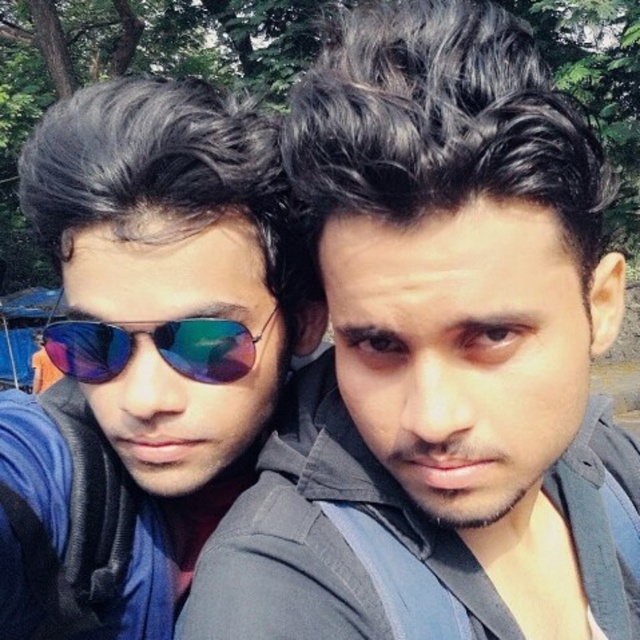
Image resolution: width=640 pixels, height=640 pixels. What do you see at coordinates (440, 355) in the screenshot? I see `dark gray hair at center` at bounding box center [440, 355].

Does dark gray hair at center have a lesser height compared to shiny reflective sunglasses at center?

No.

I want to click on dark gray hair at center, so click(440, 355).

Which of these two, dark gray hair at center or matte black sunglasses at left, stands shorter?

matte black sunglasses at left

Can you confirm if dark gray hair at center is bigger than matte black sunglasses at left?

Indeed, dark gray hair at center has a larger size compared to matte black sunglasses at left.

In the scene shown: Who is more distant from viewer, [378,17] or [224,282]?

Positioned behind is point [224,282].

At what (x,y) coordinates should I click in order to perform the action: click on dark gray hair at center. Please return your answer as a coordinate pair (x, y). Image resolution: width=640 pixels, height=640 pixels. Looking at the image, I should click on (440, 355).

Which is in front, point (166, 192) or point (86, 321)?

Point (166, 192) is more forward.

Is point (147, 424) closer to viewer compared to point (81, 324)?

No, it is behind (81, 324).

Which is in front, point (74, 561) or point (204, 342)?

Point (204, 342) is more forward.

At what (x,y) coordinates should I click in order to perform the action: click on matte black sunglasses at left. Please return your answer as a coordinate pair (x, y). The image size is (640, 640). Looking at the image, I should click on (145, 352).